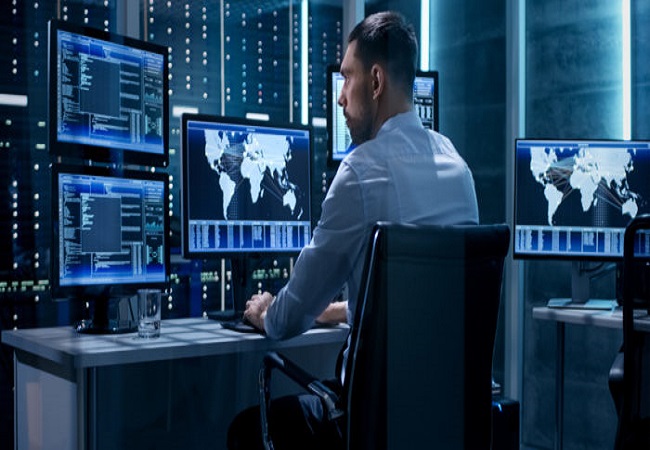
Locate an element on the screen. The height and width of the screenshot is (450, 650). monitor screens is located at coordinates (114, 220), (110, 89), (270, 187), (341, 139), (523, 176).